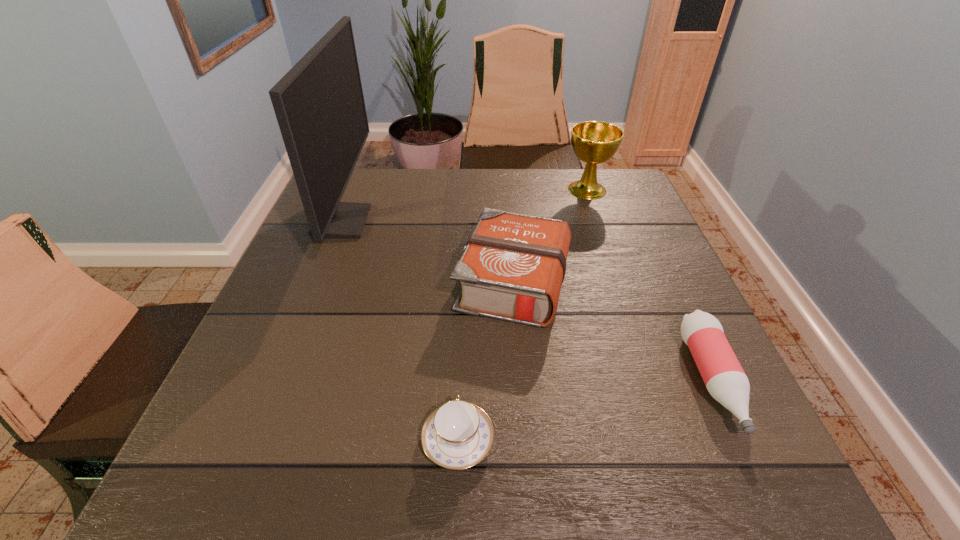
Find the location of a particular element. Image resolution: width=960 pixels, height=540 pixels. the leftmost object is located at coordinates (319, 104).

Identify the location of computer monitor. (319, 104).

Where is `the fourth shortest object`? This screenshot has height=540, width=960. the fourth shortest object is located at coordinates (594, 142).

Where is `chalice`? The width and height of the screenshot is (960, 540). chalice is located at coordinates (594, 142).

Where is `the third shortest object`? The image size is (960, 540). the third shortest object is located at coordinates (512, 268).

Where is `bottle`? Image resolution: width=960 pixels, height=540 pixels. bottle is located at coordinates coord(725,380).

Image resolution: width=960 pixels, height=540 pixels. In order to click on the second shortest object in this screenshot , I will do `click(725, 380)`.

Identify the location of teacup. (457, 435).

Locate an element on the screen. This screenshot has width=960, height=540. free space located 0.150m on the front-facing side of the computer monitor is located at coordinates (425, 222).

What are the coordinates of `free location located 0.160m on the left of the fourth object from left to right` in the screenshot? It's located at (507, 190).